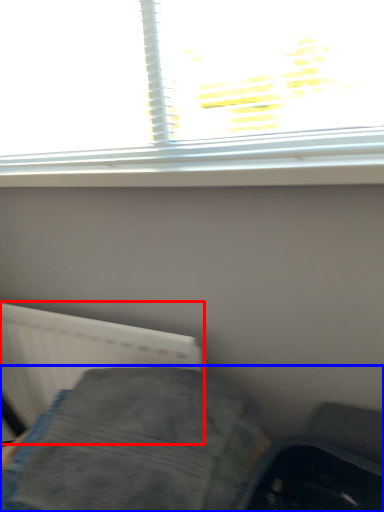
Question: Which object appears farthest to the camera in this image, radiator (highlighted by a red box) or furniture (highlighted by a blue box)?

Choices:
 (A) radiator
 (B) furniture

Answer: (A)